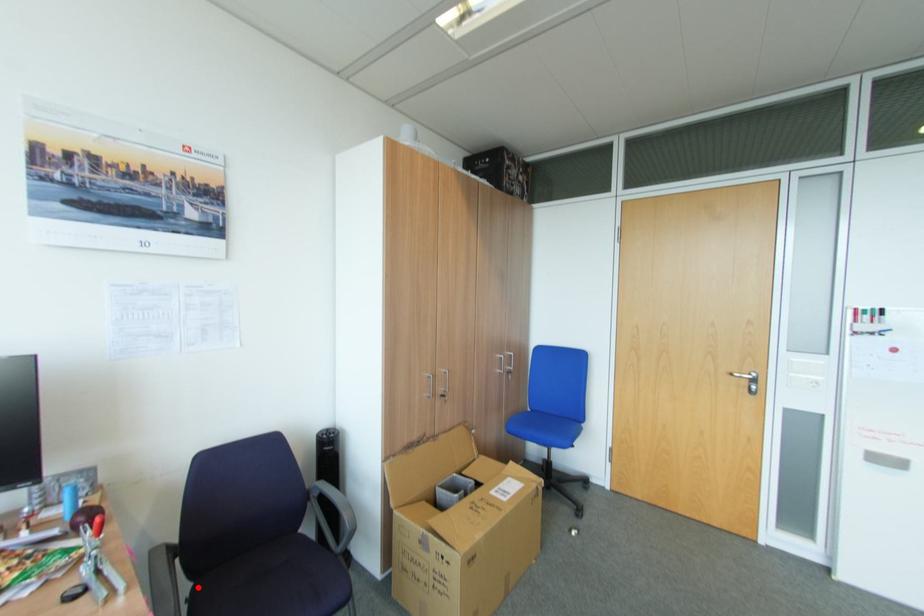
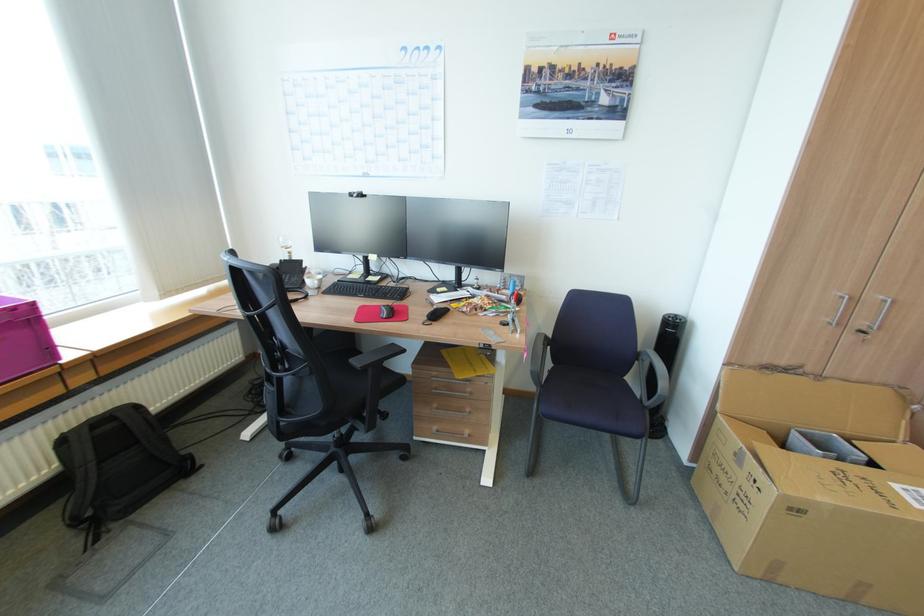
Question: I am providing you with two images of the same scene from different viewpoints. A red point is shown in image1. For the corresponding object point in image2, is it positioned nearer or farther from the camera?

Choices:
 (A) Nearer
 (B) Farther

Answer: (A)